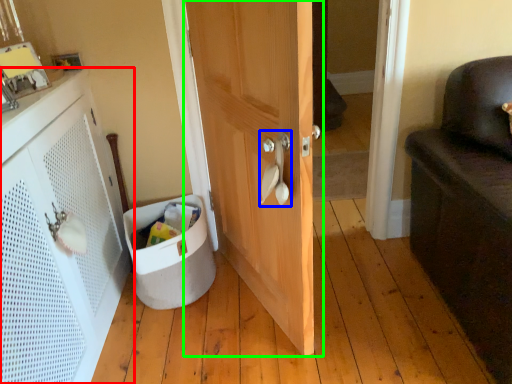
Question: Based on their relative distances, which object is nearer to cabinetry (highlighted by a red box)? Choose from door handle (highlighted by a blue box) and door (highlighted by a green box).

Choices:
 (A) door handle
 (B) door

Answer: (B)